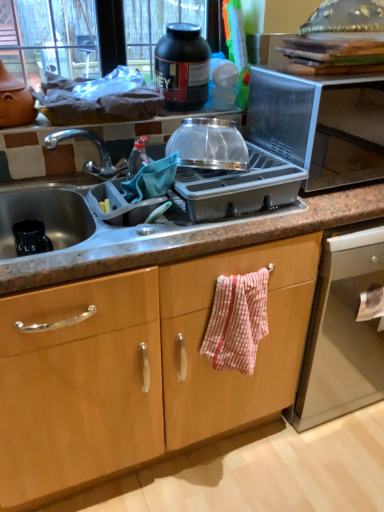
Locate an element on the screen. The image size is (384, 512). free location in front of transparent plastic bowl at upper center, arranged as the 2th kitchen appliance when viewed from the top is located at coordinates (220, 182).